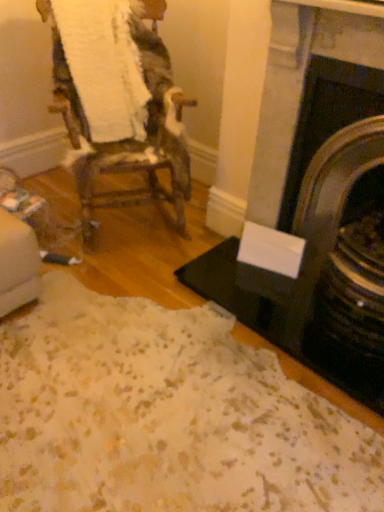
Measure the distance between point (x=324, y=343) and camera.

1.79 meters.

Find the location of a particular element. dark gray stone fireplace at right is located at coordinates (322, 213).

Describe the element at coordinates (322, 213) in the screenshot. I see `dark gray stone fireplace at right` at that location.

What do you see at coordinates (127, 139) in the screenshot?
I see `woodenchair at left` at bounding box center [127, 139].

Where is `woodenchair at left`? The height and width of the screenshot is (512, 384). woodenchair at left is located at coordinates (127, 139).

You are a GUI agent. You are given a task and a screenshot of the screen. Output one action in this format:
    pyautogui.click(x=<x>, y=<y>)
    Task: Click on the dark gray stone fireplace at right
    
    Given the screenshot: What is the action you would take?
    pyautogui.click(x=322, y=213)

Does woodenchair at left appear on the left side of dark gray stone fireplace at right?

Indeed, woodenchair at left is positioned on the left side of dark gray stone fireplace at right.

Considering their positions, is woodenchair at left located in front of or behind dark gray stone fireplace at right?

woodenchair at left is positioned farther from the viewer than dark gray stone fireplace at right.

Is point (67, 130) closer to viewer compared to point (295, 308)?

No, (67, 130) is behind (295, 308).

From the picture: From the image's perspective, is woodenchair at left located above or below dark gray stone fireplace at right?

Clearly, from the image's perspective, woodenchair at left is above dark gray stone fireplace at right.

From a real-world perspective, between woodenchair at left and dark gray stone fireplace at right, who is vertically lower?

woodenchair at left is physically lower.

Between woodenchair at left and dark gray stone fireplace at right, which one has smaller width?

dark gray stone fireplace at right is thinner.

Considering the relative sizes of woodenchair at left and dark gray stone fireplace at right in the image provided, is woodenchair at left shorter than dark gray stone fireplace at right?

Indeed, woodenchair at left has a lesser height compared to dark gray stone fireplace at right.

Is woodenchair at left bigger than dark gray stone fireplace at right?

Yes, woodenchair at left is bigger than dark gray stone fireplace at right.

Can we say woodenchair at left lies outside dark gray stone fireplace at right?

Yes, woodenchair at left is not within dark gray stone fireplace at right.

Are woodenchair at left and dark gray stone fireplace at right beside each other?

No.

Does woodenchair at left turn towards dark gray stone fireplace at right?

No, woodenchair at left is not oriented towards dark gray stone fireplace at right.

What's the angular difference between woodenchair at left and dark gray stone fireplace at right's facing directions?

The angle between the facing direction of woodenchair at left and the facing direction of dark gray stone fireplace at right is 59.8 degrees.

Find the location of `fireplace below the woodenchair at left (from the image's perspective)`. fireplace below the woodenchair at left (from the image's perspective) is located at coordinates (322, 213).

Between dark gray stone fireplace at right and woodenchair at left, which one appears on the left side from the viewer's perspective?

Positioned to the left is woodenchair at left.

Is dark gray stone fireplace at right positioned before woodenchair at left?

Yes, dark gray stone fireplace at right is closer to the camera.

Does point (349, 272) appear closer or farther from the camera than point (70, 116)?

Point (349, 272).

From the image's perspective, which one is positioned higher, dark gray stone fireplace at right or woodenchair at left?

From the image's view, woodenchair at left is above.

From a real-world perspective, is dark gray stone fireplace at right physically below woodenchair at left?

No, from a real-world perspective, dark gray stone fireplace at right is not beneath woodenchair at left.

Which of these two, dark gray stone fireplace at right or woodenchair at left, is thinner?

Thinner between the two is dark gray stone fireplace at right.

From their relative heights in the image, would you say dark gray stone fireplace at right is taller or shorter than woodenchair at left?

Considering their sizes, dark gray stone fireplace at right has more height than woodenchair at left.

Is dark gray stone fireplace at right bigger than woodenchair at left?

Incorrect, dark gray stone fireplace at right is not larger than woodenchair at left.

Is dark gray stone fireplace at right outside of woodenchair at left?

Yes, dark gray stone fireplace at right is located beyond the bounds of woodenchair at left.

Is dark gray stone fireplace at right beside woodenchair at left?

No, dark gray stone fireplace at right is not making contact with woodenchair at left.

Is dark gray stone fireplace at right oriented away from woodenchair at left?

No, woodenchair at left is not at the back of dark gray stone fireplace at right.

Find the location of `chair above the dark gray stone fireplace at right (from the image's perspective)`. chair above the dark gray stone fireplace at right (from the image's perspective) is located at coordinates (127, 139).

This screenshot has width=384, height=512. Identify the location of fireplace positioned vertically above the woodenchair at left (from a real-world perspective). (322, 213).

Find the location of `fireplace lying on the right of woodenchair at left`. fireplace lying on the right of woodenchair at left is located at coordinates (322, 213).